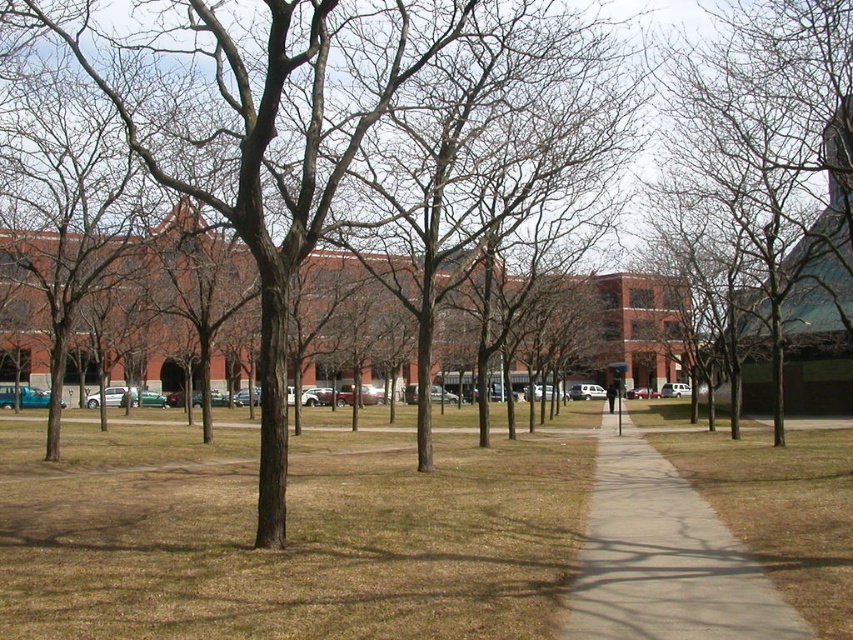
Question: Does bare wood tree at upper right appear on the left side of concrete sidewalk at center?

Choices:
 (A) yes
 (B) no

Answer: (B)

Question: Which object is farther from the camera taking this photo?

Choices:
 (A) brown dry grass at center
 (B) bare wood tree at upper right
 (C) concrete sidewalk at center

Answer: (B)

Question: Among these objects, which one is farthest from the camera?

Choices:
 (A) bare wood tree at upper right
 (B) concrete sidewalk at center

Answer: (A)

Question: Is brown dry grass at center above concrete sidewalk at center?

Choices:
 (A) yes
 (B) no

Answer: (B)

Question: Among these points, which one is nearest to the camera?

Choices:
 (A) (451, 522)
 (B) (741, 627)
 (C) (747, 61)

Answer: (B)

Question: Does brown dry grass at center appear on the left side of concrete sidewalk at center?

Choices:
 (A) no
 (B) yes

Answer: (B)